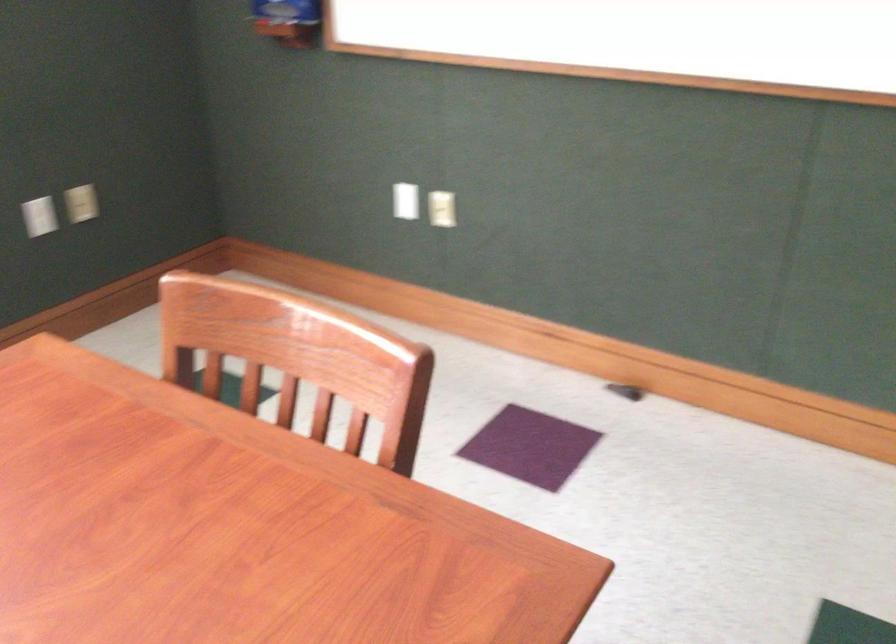
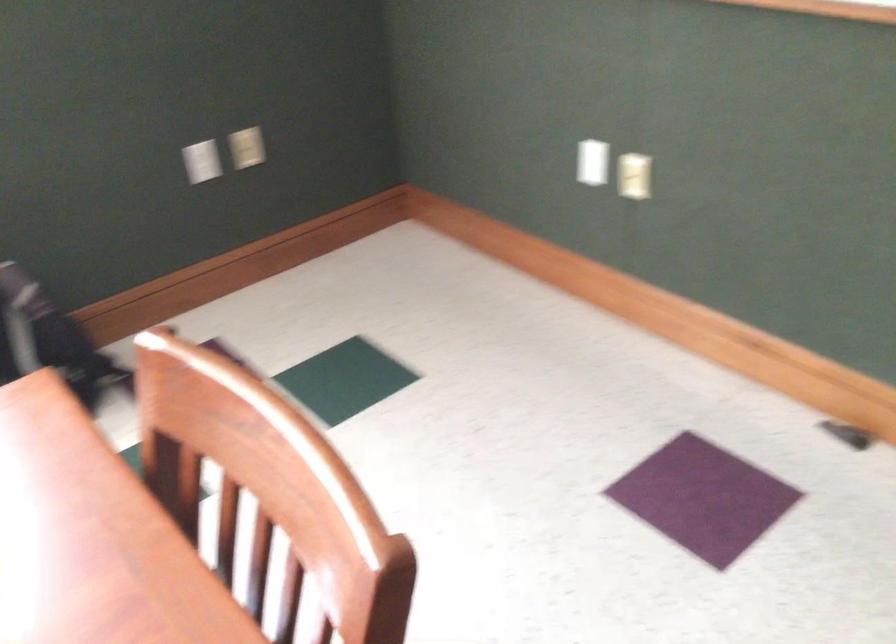
Question: The camera is either moving clockwise (left) or counter-clockwise (right) around the object. The first image is from the beginning of the video and the second image is from the end. Is the camera moving left or right when shooting the video?

Choices:
 (A) Left
 (B) Right

Answer: (B)